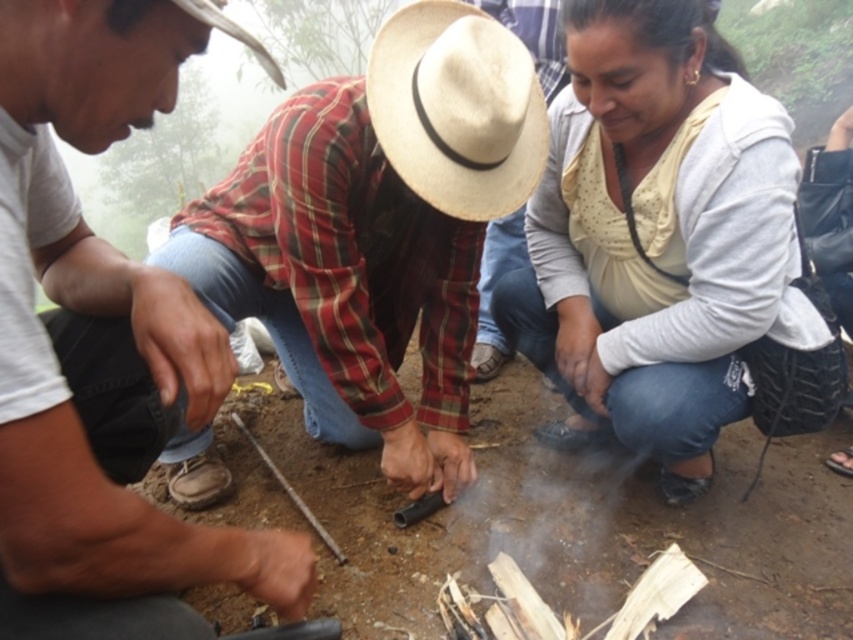
You are a photographer trying to capture a candid shot of the two people at the center of the scene. You notice the white textured sweater at center and the woven straw hat at center. Which object should you focus on first if you want to capture the person on the left side of the two?

The woven straw hat at center is to the left of the white textured sweater at center, so focusing on the woven straw hat at center first will capture the person on the left side.

Based on the coordinates provided, which object is located at point [102,349] in the image?

The point [102,349] corresponds to the plaid fabric shirt at center.

You are standing at the center of the image. Where is the plaid fabric shirt at center located relative to your current position?

The plaid fabric shirt at center is located at point 0.547 on the x axis and 0.121 on the y axis relative to the center of the image.